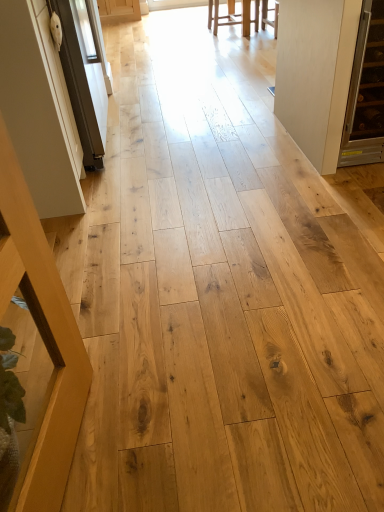
Question: From a real-world perspective, is white matte door at right on top of light brown wood stool at upper center, the 2th furniture in the left-to-right sequence?

Choices:
 (A) no
 (B) yes

Answer: (B)

Question: From the image's perspective, is white matte door at right under light brown wood stool at upper center, which is the 2th furniture in front-to-back order?

Choices:
 (A) yes
 (B) no

Answer: (A)

Question: Is white matte door at right shorter than light brown wood stool at upper center, which ranks as the first furniture in back-to-front order?

Choices:
 (A) no
 (B) yes

Answer: (A)

Question: Considering the relative positions of white matte door at right and light brown wood stool at upper center, which is the 2th furniture in front-to-back order, in the image provided, is white matte door at right in front of light brown wood stool at upper center, which is the 2th furniture in front-to-back order,?

Choices:
 (A) no
 (B) yes

Answer: (B)

Question: Considering the relative positions of white matte door at right and light brown wood stool at upper center, the second furniture positioned from the bottom, in the image provided, is white matte door at right behind light brown wood stool at upper center, the second furniture positioned from the bottom,?

Choices:
 (A) yes
 (B) no

Answer: (B)

Question: Is white matte door at right turned away from light brown wood stool at upper center, the 2th furniture in the left-to-right sequence?

Choices:
 (A) yes
 (B) no

Answer: (B)

Question: Is white matte door at right in contact with white glossy screen door at left?

Choices:
 (A) yes
 (B) no

Answer: (B)

Question: Is white matte door at right turned away from white glossy screen door at left?

Choices:
 (A) yes
 (B) no

Answer: (B)

Question: Is white matte door at right at the right side of white glossy screen door at left?

Choices:
 (A) yes
 (B) no

Answer: (A)

Question: Can you confirm if white matte door at right is wider than white glossy screen door at left?

Choices:
 (A) no
 (B) yes

Answer: (B)

Question: Is the position of white matte door at right more distant than that of white glossy screen door at left?

Choices:
 (A) no
 (B) yes

Answer: (A)

Question: Can you confirm if white matte door at right is thinner than white glossy screen door at left?

Choices:
 (A) no
 (B) yes

Answer: (A)

Question: Does white glossy screen door at left appear on the left side of light brown wood stool at upper center, the first furniture positioned from the top?

Choices:
 (A) yes
 (B) no

Answer: (A)